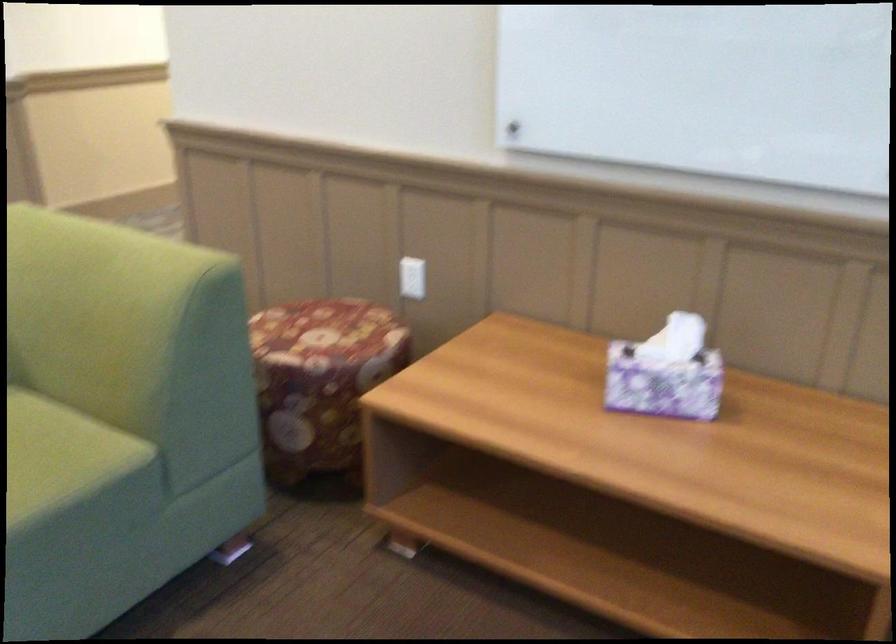
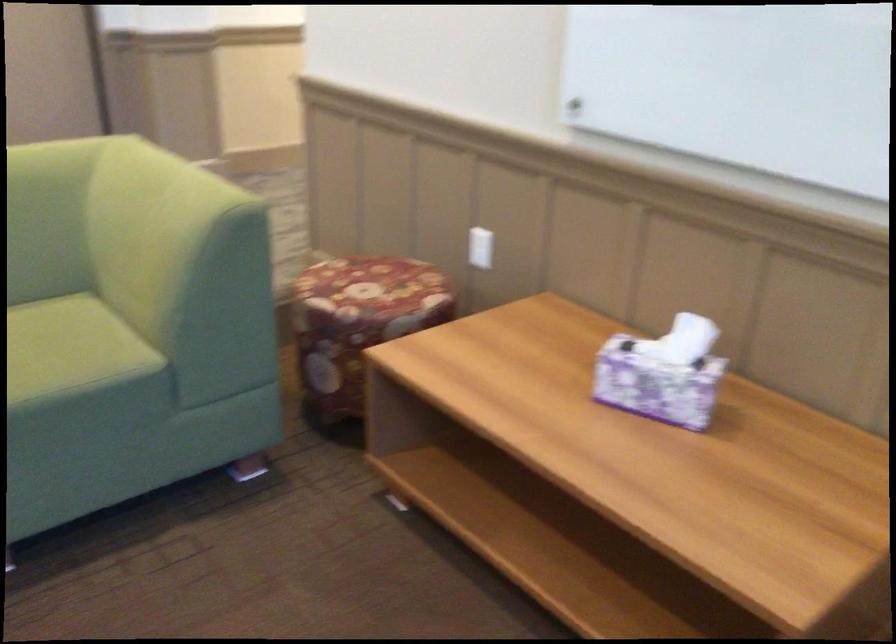
In the second image, find the point that corresponds to point 126,251 in the first image.

(181, 184)